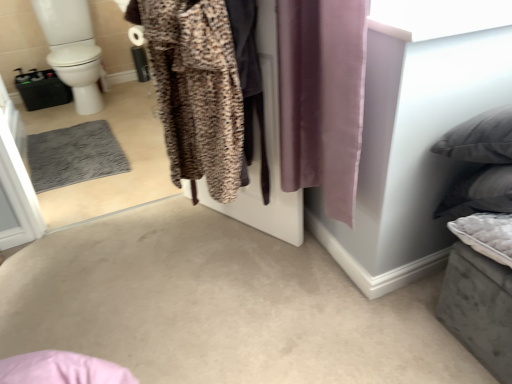
Where is `empty space that is to the right of white glossy toilet bowl at left`? The width and height of the screenshot is (512, 384). empty space that is to the right of white glossy toilet bowl at left is located at coordinates (133, 103).